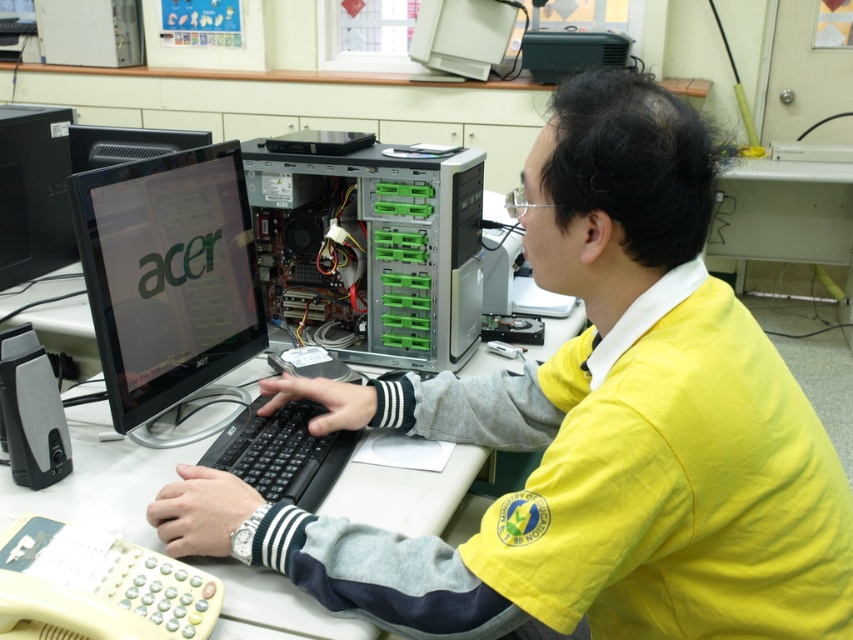
Is white plastic table at center bigger than black plastic keyboard at center?

Yes, white plastic table at center is bigger than black plastic keyboard at center.

Where is `white plastic table at center`? white plastic table at center is located at coordinates (102, 480).

Is green plastic desktop computer at center closer to the viewer compared to black plastic keyboard at center?

No, green plastic desktop computer at center is behind black plastic keyboard at center.

Does green plastic desktop computer at center appear over black plastic keyboard at center?

Indeed, green plastic desktop computer at center is positioned over black plastic keyboard at center.

Locate an element on the screen. green plastic desktop computer at center is located at coordinates (374, 248).

Find the location of a particular element. green plastic desktop computer at center is located at coordinates (374, 248).

Between point (366, 544) and point (68, 634), which one is positioned in front?

Positioned in front is point (68, 634).

Can you confirm if yellow fabric shirt at center is smaller than beige plastic telephone at lower left?

No.

Who is more forward, (387, 388) or (86, 588)?

Point (86, 588)

Locate an element on the screen. This screenshot has height=640, width=853. yellow fabric shirt at center is located at coordinates (587, 432).